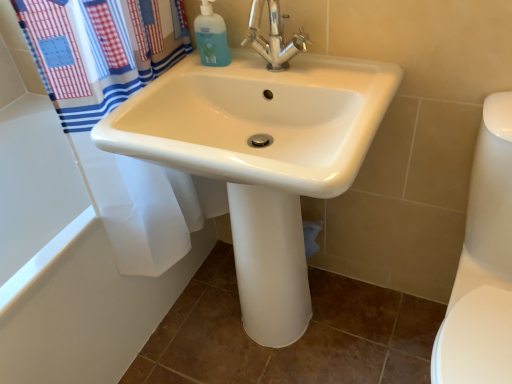
Image resolution: width=512 pixels, height=384 pixels. What are the coordinates of `vacant space situated on the left part of polished chrome faucet at center` in the screenshot? It's located at (212, 77).